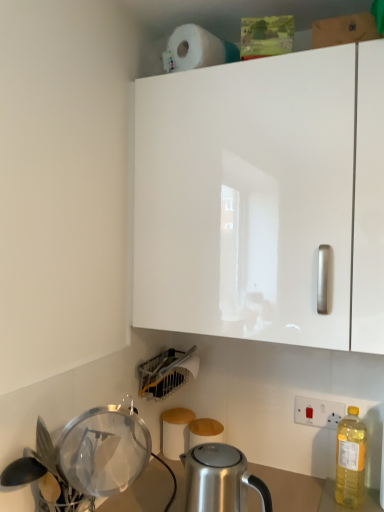
This screenshot has height=512, width=384. I want to click on blank space above satin silver kettle at lower center (from a real-world perspective), so click(213, 454).